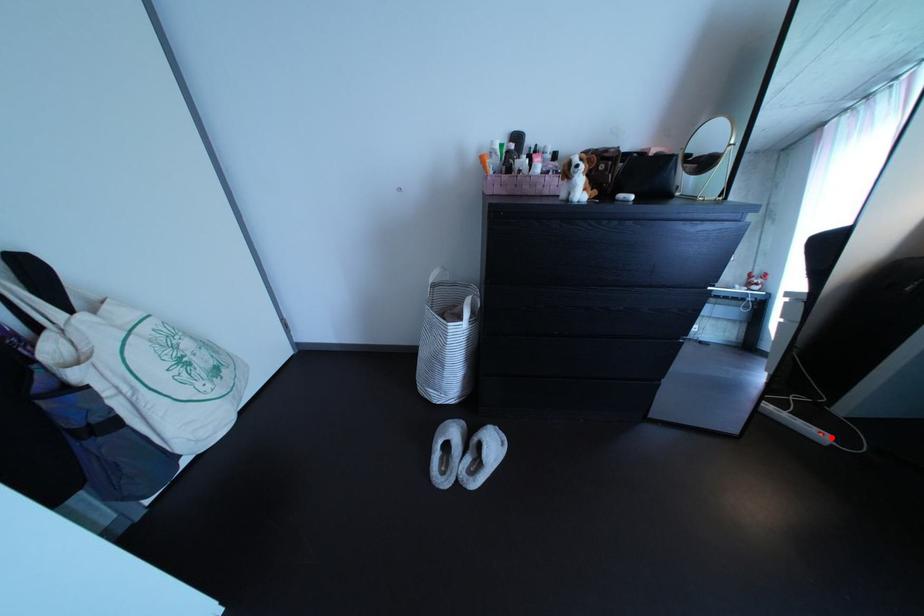
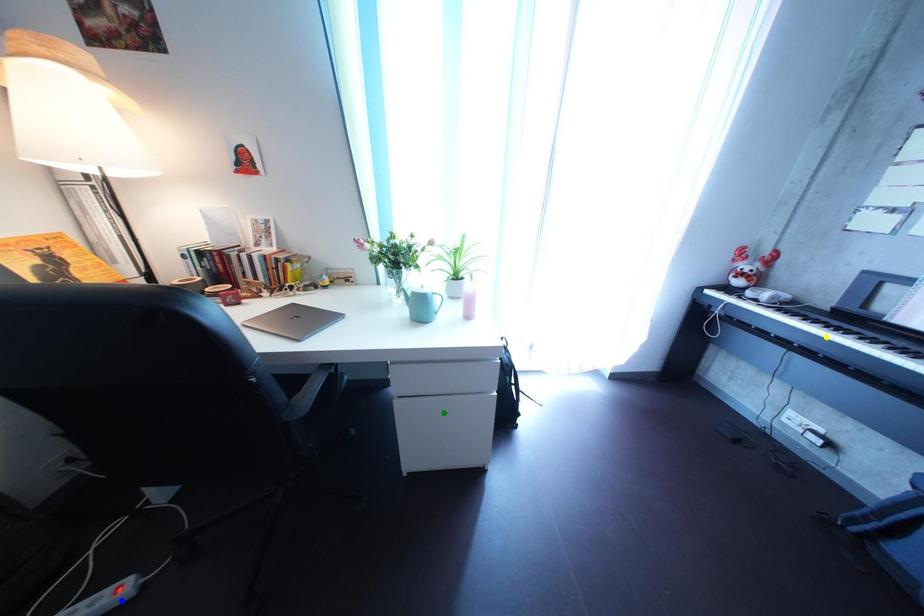
Question: I am providing you with two images of the same scene from different viewpoints. A red point is marked on the first image. You are given multiple points on the second image. Which spot in image 2 lines up with the point in image 1?

Choices:
 (A) yellow point
 (B) blue point
 (C) green point

Answer: (B)